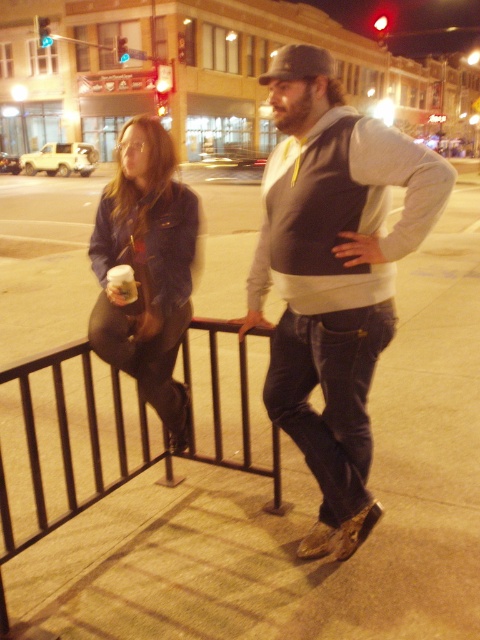
Question: Which point is farther to the camera?

Choices:
 (A) (21, 272)
 (B) (105, 237)
 (C) (349, 355)
 (D) (29, 403)

Answer: (A)

Question: Can you confirm if gray hoodie at center is positioned to the left of black metal railing at lower left?

Choices:
 (A) yes
 (B) no

Answer: (B)

Question: Where is brown concrete pavement at center located in relation to denim jacket at left in the image?

Choices:
 (A) below
 (B) above

Answer: (B)

Question: Does brown concrete pavement at center appear on the right side of denim jacket at left?

Choices:
 (A) yes
 (B) no

Answer: (A)

Question: Which object is farther from the camera taking this photo?

Choices:
 (A) brown concrete pavement at center
 (B) denim jacket at left
 (C) gray hoodie at center

Answer: (B)

Question: Which point is farther from the camera taking this photo?

Choices:
 (A) (224, 518)
 (B) (190, 227)

Answer: (A)